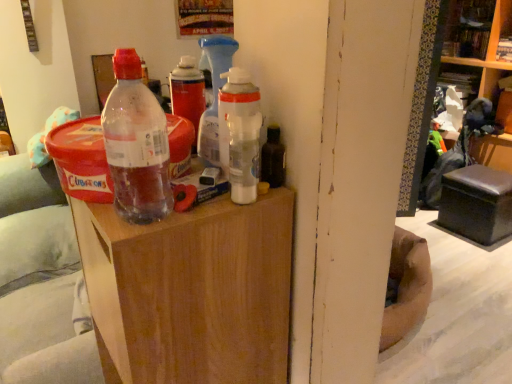
Question: Is wooden bookshelf at upper right, the second shelf ordered from the bottom, beside wooden bookshelf at upper right, the 2th shelf viewed from the top?

Choices:
 (A) no
 (B) yes

Answer: (B)

Question: Can you confirm if wooden bookshelf at upper right, the 1th shelf from the top, is bigger than wooden bookshelf at upper right, the 2th shelf viewed from the top?

Choices:
 (A) yes
 (B) no

Answer: (B)

Question: Does wooden bookshelf at upper right, the 1th shelf from the top, have a greater width compared to wooden bookshelf at upper right, the 2th shelf viewed from the top?

Choices:
 (A) yes
 (B) no

Answer: (B)

Question: From the image's perspective, is wooden bookshelf at upper right, the second shelf ordered from the bottom, under wooden bookshelf at upper right, the 2th shelf viewed from the top?

Choices:
 (A) yes
 (B) no

Answer: (B)

Question: From a real-world perspective, is wooden bookshelf at upper right, the 1th shelf from the top, below wooden bookshelf at upper right, the 2th shelf viewed from the top?

Choices:
 (A) yes
 (B) no

Answer: (B)

Question: Would you say wooden bookshelf at upper right, the 1th shelf from the top, is to the left or to the right of translucent plastic bottle at center in the picture?

Choices:
 (A) right
 (B) left

Answer: (A)

Question: From a real-world perspective, is wooden bookshelf at upper right, the second shelf ordered from the bottom, positioned above or below translucent plastic bottle at center?

Choices:
 (A) above
 (B) below

Answer: (B)

Question: Would you say wooden bookshelf at upper right, the 1th shelf from the top, is inside or outside translucent plastic bottle at center?

Choices:
 (A) inside
 (B) outside

Answer: (B)

Question: From the image's perspective, is wooden bookshelf at upper right, the second shelf ordered from the bottom, located above or below translucent plastic bottle at center?

Choices:
 (A) below
 (B) above

Answer: (B)

Question: Is wooden side table at center taller or shorter than translucent plastic bottle at center?

Choices:
 (A) short
 (B) tall

Answer: (B)

Question: From a real-world perspective, is wooden side table at center positioned above or below translucent plastic bottle at center?

Choices:
 (A) above
 (B) below

Answer: (B)

Question: Relative to translucent plastic bottle at center, is wooden side table at center in front or behind?

Choices:
 (A) front
 (B) behind

Answer: (B)

Question: Choose the correct answer: Is wooden side table at center inside translucent plastic bottle at center or outside it?

Choices:
 (A) outside
 (B) inside

Answer: (A)

Question: Based on their positions, is translucent plastic bottle at center located to the left or right of wooden bookshelf at upper right, the second shelf ordered from the bottom?

Choices:
 (A) right
 (B) left

Answer: (B)

Question: Is translucent plastic bottle at center situated inside wooden bookshelf at upper right, the 1th shelf from the top, or outside?

Choices:
 (A) outside
 (B) inside

Answer: (A)